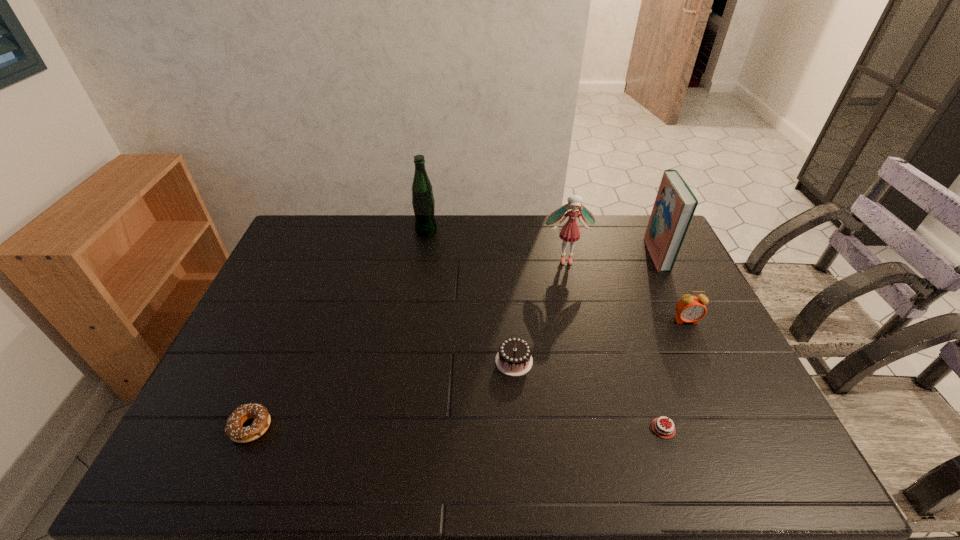
This screenshot has height=540, width=960. Identify the location of the second object from left to right. (423, 202).

Where is `hardback book`? hardback book is located at coordinates (675, 204).

You are a GUI agent. You are given a task and a screenshot of the screen. Output one action in this format:
    pyautogui.click(x=<x>, y=<y>)
    Task: Click on the fourth object from right to left
    The width and height of the screenshot is (960, 540).
    Given the screenshot: What is the action you would take?
    pyautogui.click(x=570, y=232)

Where is `the fourth nearest object`? the fourth nearest object is located at coordinates (690, 308).

Locate an element on the screen. the fourth tallest object is located at coordinates (690, 308).

Find the location of a particular element. This screenshot has width=960, height=540. the farther chocolate cake is located at coordinates (514, 358).

Where is `the fifth object from right to left`? This screenshot has height=540, width=960. the fifth object from right to left is located at coordinates (514, 358).

This screenshot has height=540, width=960. In order to click on doughnut in this screenshot , I will do `click(233, 429)`.

Locate an element on the screen. This screenshot has height=540, width=960. the leftmost object is located at coordinates (233, 429).

Locate an element on the screen. The width and height of the screenshot is (960, 540). the shorter chocolate cake is located at coordinates (661, 428).